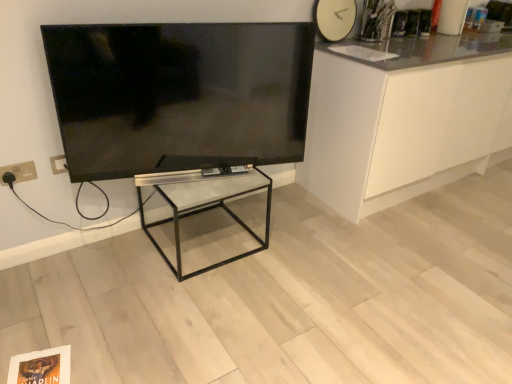
At what (x,y) coordinates should I click in order to perform the action: click on vacant area that is in front of white glossy cabinet at right. Please return your answer as a coordinate pair (x, y). This screenshot has height=384, width=512. Looking at the image, I should click on (417, 258).